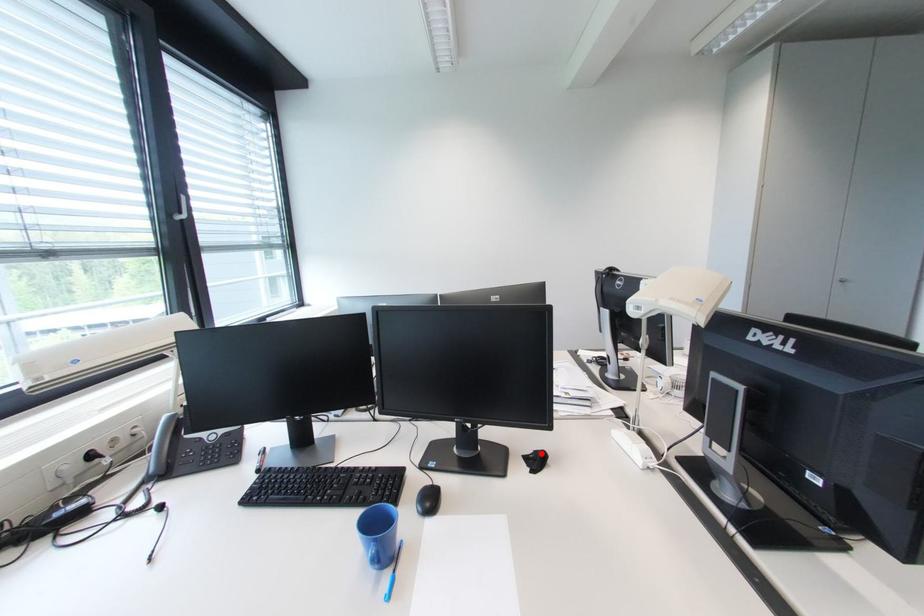
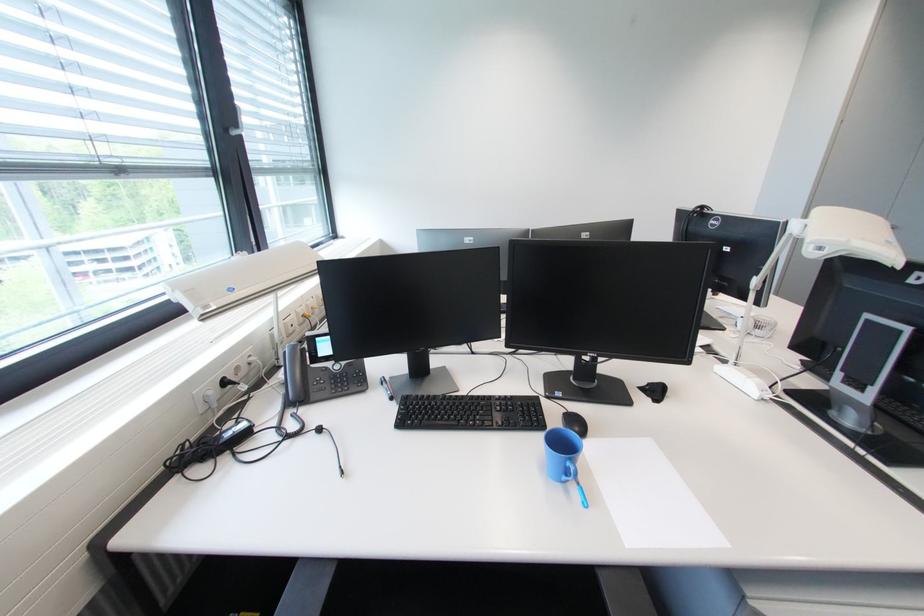
In the second image, find the point that corresponds to the highlighted location in the first image.

(655, 386)